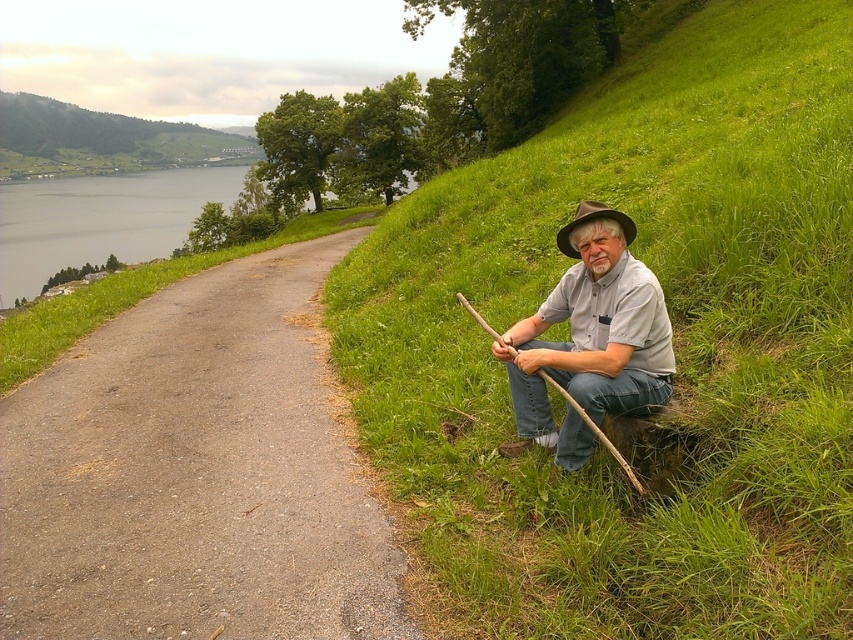
You are standing at the base of the slope where the man is sitting. You want to walk to the gray asphalt road at center. In which direction should you go relative to your current position?

The gray asphalt road at center is located at point coordinates of (196, 474). Since you are at the base of the slope where the man is sitting, you should walk forward towards the center of the image to reach the gray asphalt road at center.

You are a hiker trying to find the highest point in the area. You see the green grassy hillside at right and the green grassy hillside at upper left. Which one is higher?

The green grassy hillside at upper left is higher because it is positioned above the green grassy hillside at right.

You are standing at the point labeled point (61, 154) and want to walk towards the point labeled point (730, 412). Which direction should you move relative to the camera?

You should move away from the camera because point (730, 412) is closer to the camera than point (61, 154).